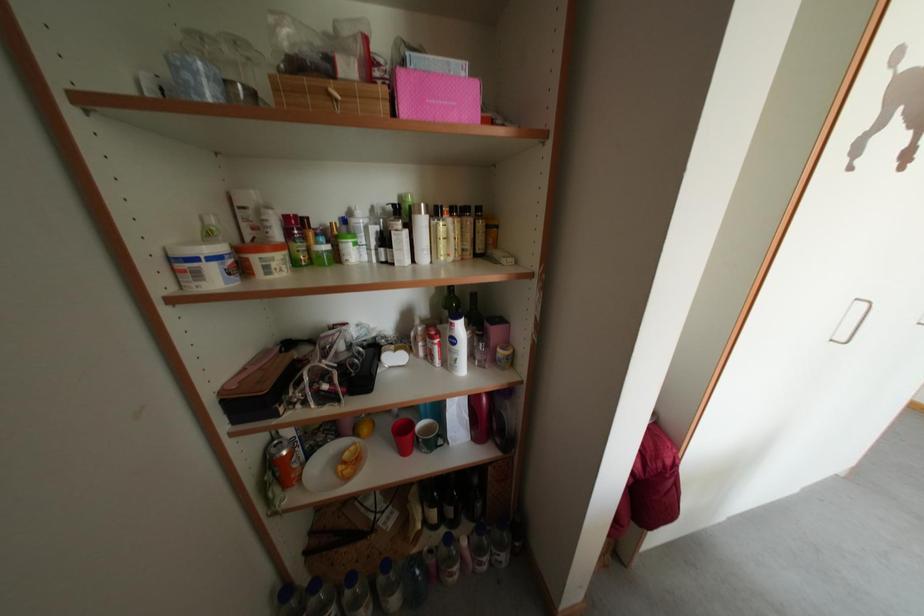
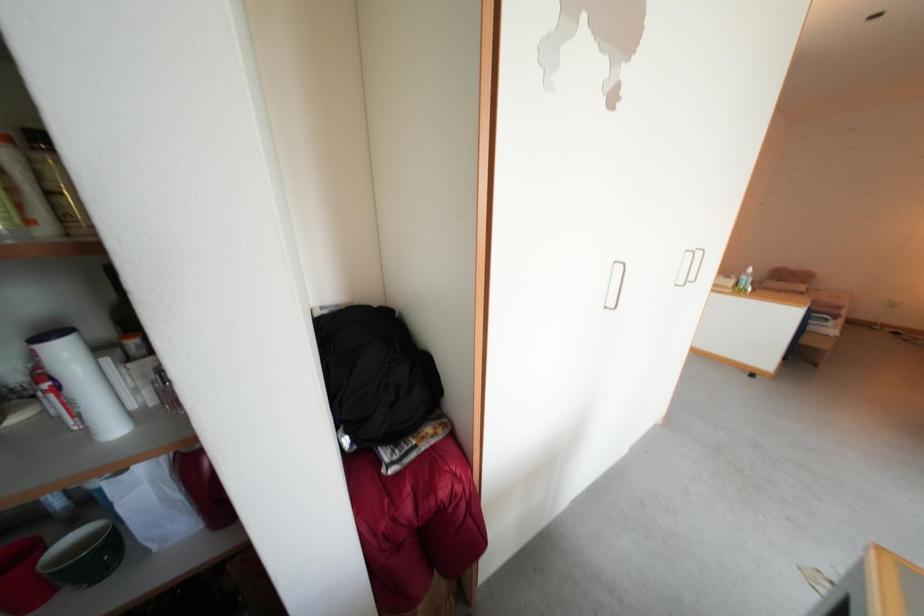
Question: The camera is either moving clockwise (left) or counter-clockwise (right) around the object. The first image is from the beginning of the video and the second image is from the end. Is the camera moving left or right when shooting the video?

Choices:
 (A) Left
 (B) Right

Answer: (A)